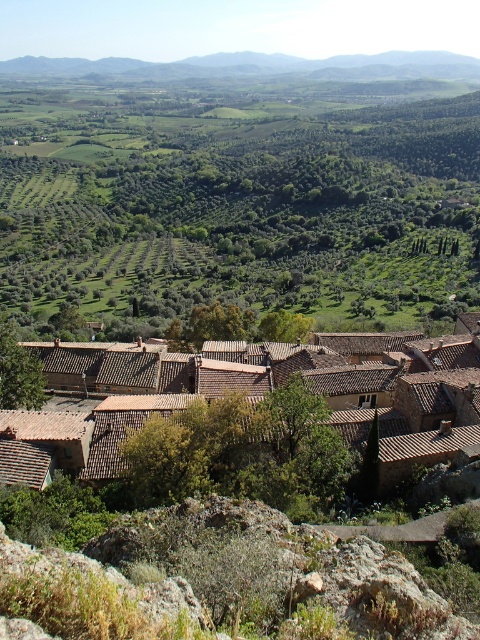
Is brown clay roof tiles at center thinner than gray rocky mountain at upper center?

Yes, brown clay roof tiles at center is thinner than gray rocky mountain at upper center.

Who is more distant from viewer, (172, 387) or (163, 72)?

Point (163, 72)

The image size is (480, 640). Find the location of `brown clay roof tiles at center`. brown clay roof tiles at center is located at coordinates (345, 387).

Does green leafy trees at center appear over gray rocky mountain at upper center?

No, green leafy trees at center is not above gray rocky mountain at upper center.

Between point (155, 296) and point (433, 68), which one is positioned behind?

The point (433, 68) is more distant.

Is point (219, 179) positioned behind point (112, 67)?

No, it is in front of (112, 67).

Image resolution: width=480 pixels, height=640 pixels. I want to click on green leafy trees at center, so click(237, 212).

Does green leafy trees at center have a greater height compared to brown clay roof tiles at center?

Correct, green leafy trees at center is much taller as brown clay roof tiles at center.

Between point (57, 236) and point (472, 416), which one is positioned in front?

Positioned in front is point (472, 416).

Does point (434, 120) come farther from viewer compared to point (420, 426)?

That is True.

Where is `green leafy trees at center`? The image size is (480, 640). green leafy trees at center is located at coordinates (237, 212).